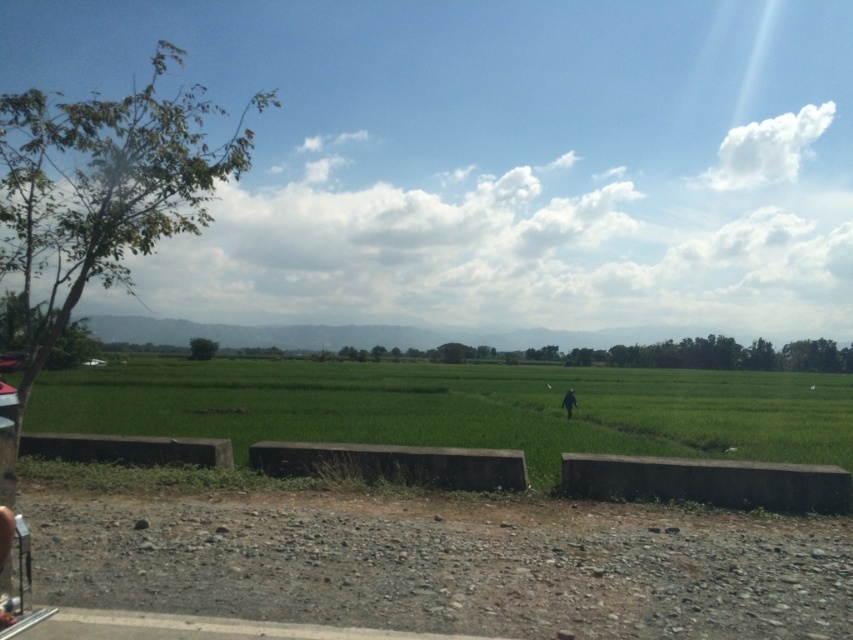
Is green grass field at center bigger than dark green grass at center?

Yes.

Between green grass field at center and dark green grass at center, which one is positioned higher?

dark green grass at center is above.

Does point (811, 412) come closer to viewer compared to point (561, 397)?

Yes, it is in front of point (561, 397).

Find the location of a particular element. green grass field at center is located at coordinates (460, 406).